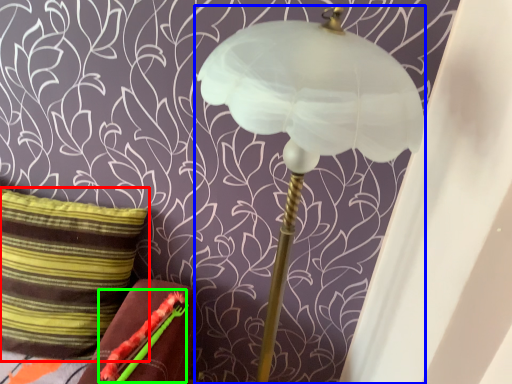
Question: Considering the real-world distances, which object is closest to pillow (highlighted by a red box)? lamp (highlighted by a blue box) or flower (highlighted by a green box).

Choices:
 (A) lamp
 (B) flower

Answer: (B)